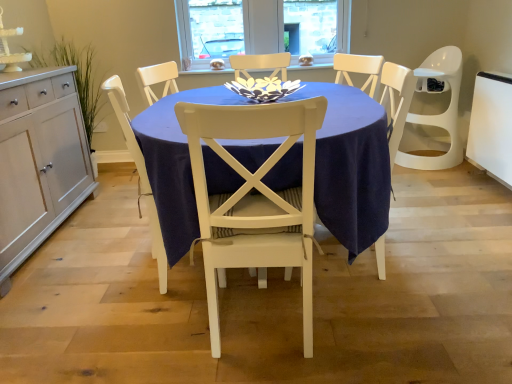
Question: Which direction should I rotate to look at white painted wood chair at center, which is counted as the 2th chair, starting from the left?

Choices:
 (A) right
 (B) left

Answer: (B)

Question: Could you tell me if white painted wood chair at center, the first chair positioned from the right, is turned towards white wood cabinet at left?

Choices:
 (A) yes
 (B) no

Answer: (B)

Question: Does white painted wood chair at center, which is counted as the 2th chair, starting from the left, have a greater height compared to white wood cabinet at left?

Choices:
 (A) no
 (B) yes

Answer: (B)

Question: From a real-world perspective, is white painted wood chair at center, which is counted as the 2th chair, starting from the left, on top of white wood cabinet at left?

Choices:
 (A) no
 (B) yes

Answer: (B)

Question: Is white painted wood chair at center, which is counted as the 2th chair, starting from the left, positioned before white wood cabinet at left?

Choices:
 (A) yes
 (B) no

Answer: (A)

Question: Can you confirm if white painted wood chair at center, the first chair positioned from the right, is thinner than white wood cabinet at left?

Choices:
 (A) yes
 (B) no

Answer: (B)

Question: From the image's perspective, is white painted wood chair at center, the first chair positioned from the right, located beneath white wood cabinet at left?

Choices:
 (A) yes
 (B) no

Answer: (A)

Question: Does navy blue fabric table at center have a smaller size compared to white painted wood chair at center, which is counted as the 2th chair, starting from the left?

Choices:
 (A) yes
 (B) no

Answer: (B)

Question: Does navy blue fabric table at center have a greater height compared to white painted wood chair at center, the first chair positioned from the right?

Choices:
 (A) yes
 (B) no

Answer: (B)

Question: Does navy blue fabric table at center lie behind white painted wood chair at center, which is counted as the 2th chair, starting from the left?

Choices:
 (A) no
 (B) yes

Answer: (B)

Question: Is there a large distance between navy blue fabric table at center and white painted wood chair at center, which is counted as the 2th chair, starting from the left?

Choices:
 (A) yes
 (B) no

Answer: (B)

Question: From the image's perspective, would you say navy blue fabric table at center is shown under white painted wood chair at center, the first chair positioned from the right?

Choices:
 (A) no
 (B) yes

Answer: (A)

Question: Does navy blue fabric table at center come in front of white painted wood chair at center, which is counted as the 2th chair, starting from the left?

Choices:
 (A) yes
 (B) no

Answer: (B)

Question: From a real-world perspective, does navy blue fabric table at center stand above white wood chair at center, positioned as the second chair in right-to-left order?

Choices:
 (A) yes
 (B) no

Answer: (B)